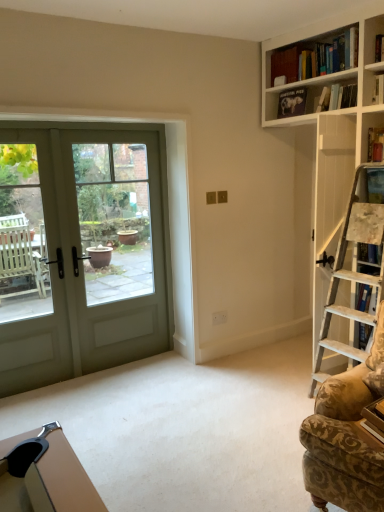
Question: From the image's perspective, is green matte screen door at left above or below green matte door at left?

Choices:
 (A) below
 (B) above

Answer: (A)

Question: From a real-world perspective, relative to green matte door at left, is green matte screen door at left vertically above or below?

Choices:
 (A) below
 (B) above

Answer: (A)

Question: Considering the real-world distances, which object is closest to the hardcover book at upper right, the 2th book when ordered from top to bottom?

Choices:
 (A) matte black book at upper center, which is the 1th book in top-to-bottom order
 (B) green matte screen door at left
 (C) green matte door at left
 (D) patterned fabric rocking chair at right

Answer: (A)

Question: Which object is the farthest from the matte black book at upper center, which is the 1th book in top-to-bottom order?

Choices:
 (A) hardcover book at upper right, acting as the 2th book starting from the left
 (B) patterned fabric rocking chair at right
 (C) green matte door at left
 (D) green matte screen door at left

Answer: (B)